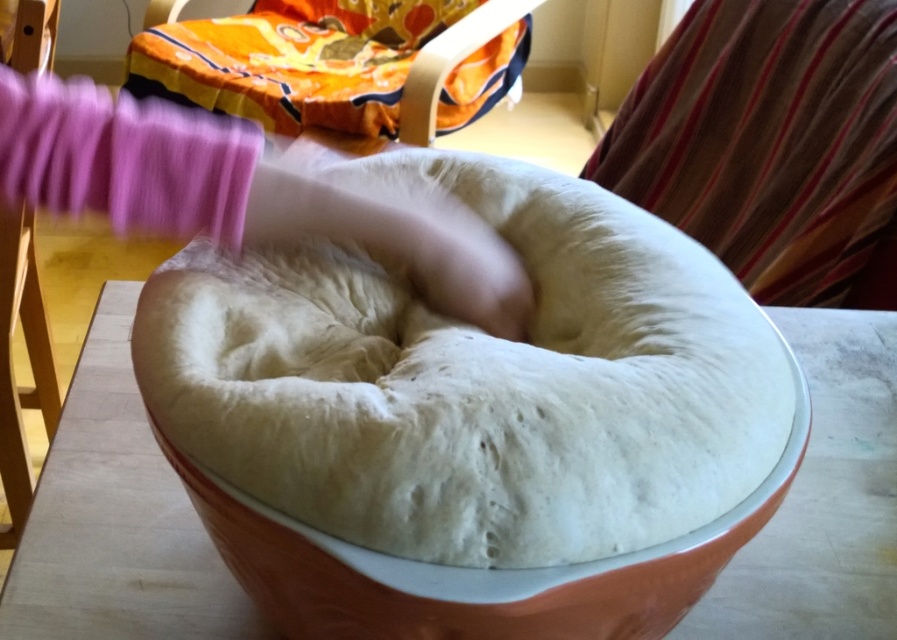
You are a baker who needs to check the dough in the bowl. When you look at the image, which object is positioned higher between the white dough at center and the white glossy bowl at center?

The white dough at center is above the white glossy bowl at center, so the dough is positioned higher.

You are a baker trying to reach the white glossy bowl at center behind the white dough at center. Can you easily access it without moving the dough?

The white dough at center is closer to the viewer than the white glossy bowl at center, so the dough is blocking the bowl. You cannot easily access the bowl without moving the dough.